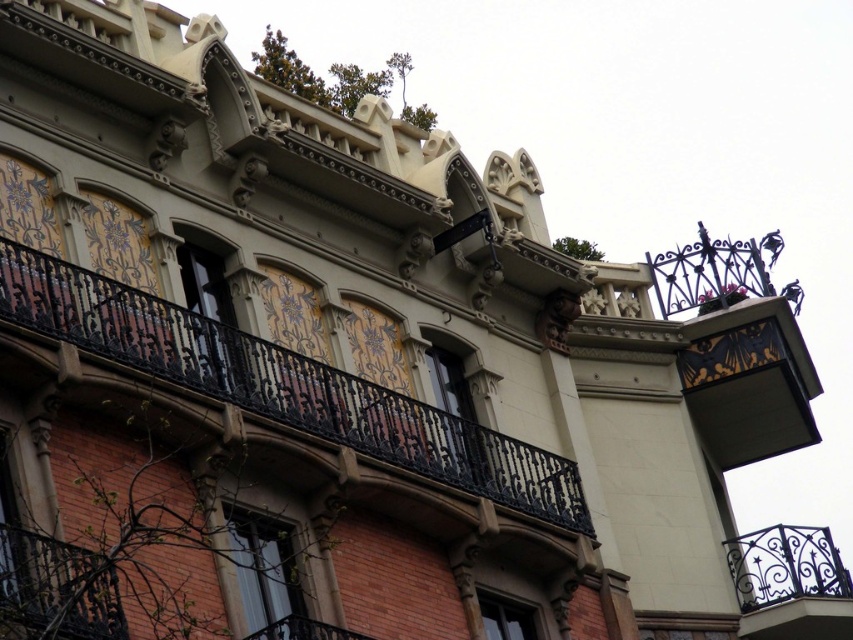
You are an architect evaluating the building facade. You notice the wrought iron balcony at upper right and the black wrought iron balcony at lower left. Which balcony has a greater height?

The wrought iron balcony at upper right is taller than the black wrought iron balcony at lower left.

You are standing in front of the building and want to take a photo. There are two points marked on the building facade. The first point is at coordinate point (820, 596) and the second is at point (24, 625). Which point is closer to your camera lens?

Point (24, 625) is closer to the camera lens because it is less further away than point (820, 596).